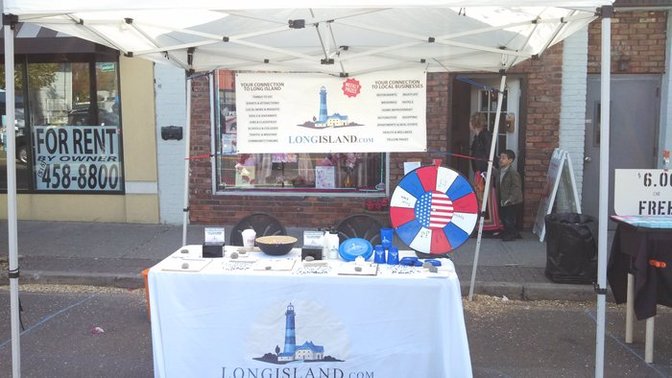
In order to click on metal table legs in this screenshot , I will do `click(632, 322)`, `click(648, 337)`.